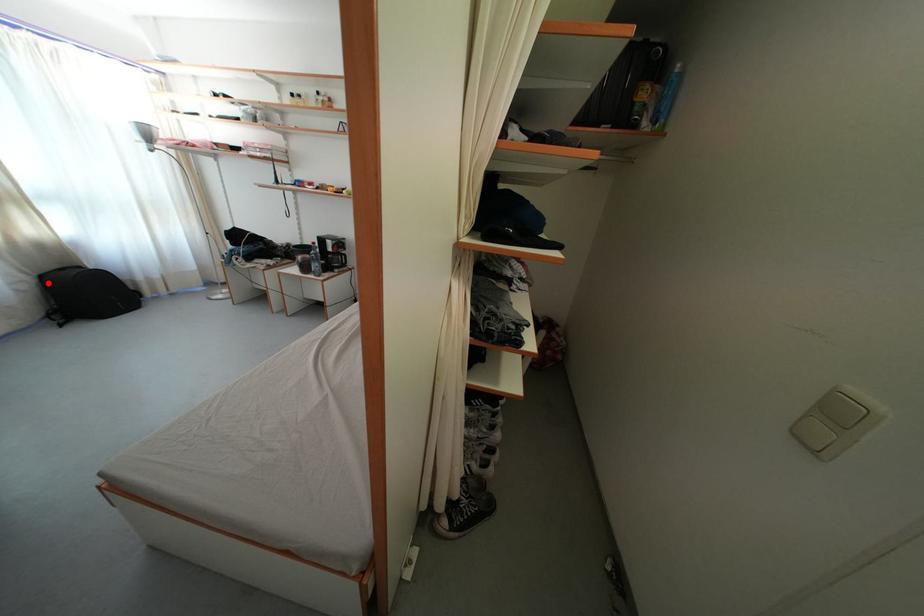
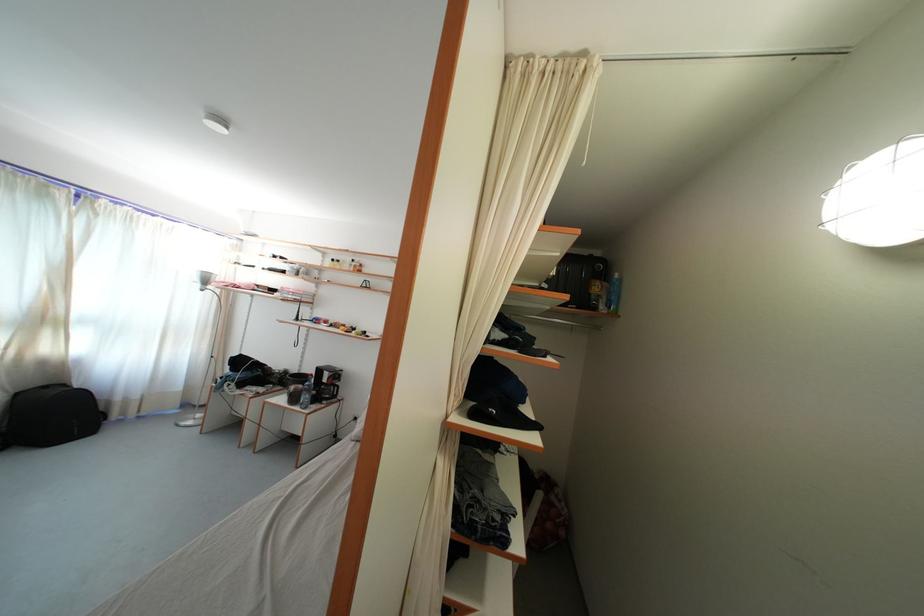
The point at the highlighted location is marked in the first image. Where is the corresponding point in the second image?

(23, 400)